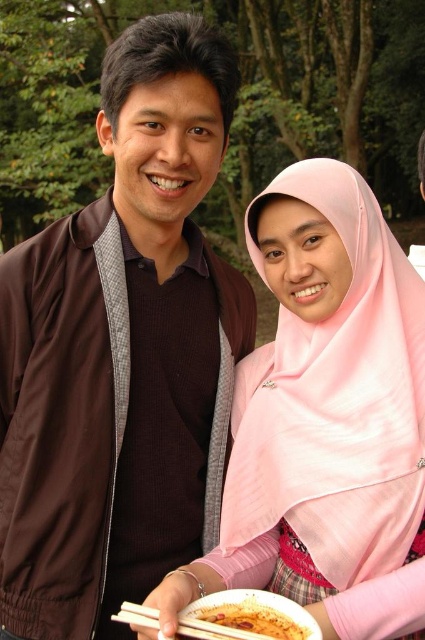
Question: From the image, what is the correct spatial relationship of pink satin hijab at center in relation to yellowish matte food at lower center?

Choices:
 (A) below
 (B) above

Answer: (B)

Question: Is white matte chopsticks at lower center thinner than yellowish matte food at lower center?

Choices:
 (A) yes
 (B) no

Answer: (B)

Question: Which point is closer to the camera taking this photo?

Choices:
 (A) (47, 525)
 (B) (255, 621)

Answer: (B)

Question: Which object is closer to the camera taking this photo?

Choices:
 (A) white matte chopsticks at lower center
 (B) yellowish matte food at lower center
 (C) pink satin hijab at center

Answer: (A)

Question: Which is farther from the yellowish matte food at lower center?

Choices:
 (A) pink satin hijab at center
 (B) brown matte jacket at left
 (C) white matte chopsticks at lower center

Answer: (B)

Question: Considering the relative positions of pink satin hijab at center and white matte chopsticks at lower center in the image provided, where is pink satin hijab at center located with respect to white matte chopsticks at lower center?

Choices:
 (A) left
 (B) right

Answer: (B)